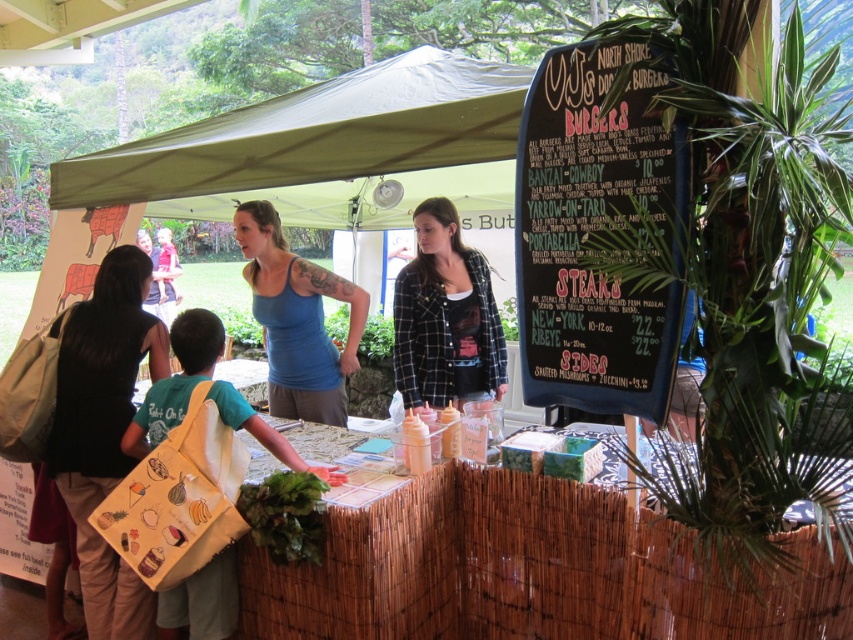
Question: Considering the relative positions of black chalkboard menu at upper right and black fabric bag at lower left in the image provided, where is black chalkboard menu at upper right located with respect to black fabric bag at lower left?

Choices:
 (A) right
 (B) left

Answer: (A)

Question: Estimate the real-world distances between objects in this image. Which object is closer to the green fabric canopy at upper center?

Choices:
 (A) black plaid shirt at center
 (B) green leafy at lower center

Answer: (A)

Question: Does black chalkboard menu at upper right appear over green leafy at lower center?

Choices:
 (A) no
 (B) yes

Answer: (B)

Question: Which point is farther to the camera?

Choices:
 (A) black plaid shirt at center
 (B) green fabric canopy at upper center

Answer: (A)

Question: Which point is farther to the camera?

Choices:
 (A) (300, 326)
 (B) (128, 596)
 (C) (283, 104)

Answer: (C)

Question: Can you confirm if black fabric bag at lower left is wider than green leafy at lower center?

Choices:
 (A) yes
 (B) no

Answer: (A)